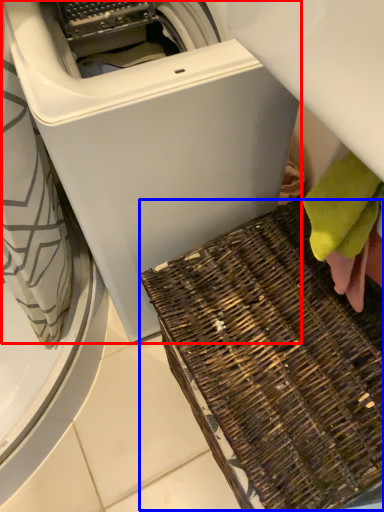
Question: Which point is further to the camera, washing machine (highlighted by a red box) or waste (highlighted by a blue box)?

Choices:
 (A) washing machine
 (B) waste

Answer: (B)